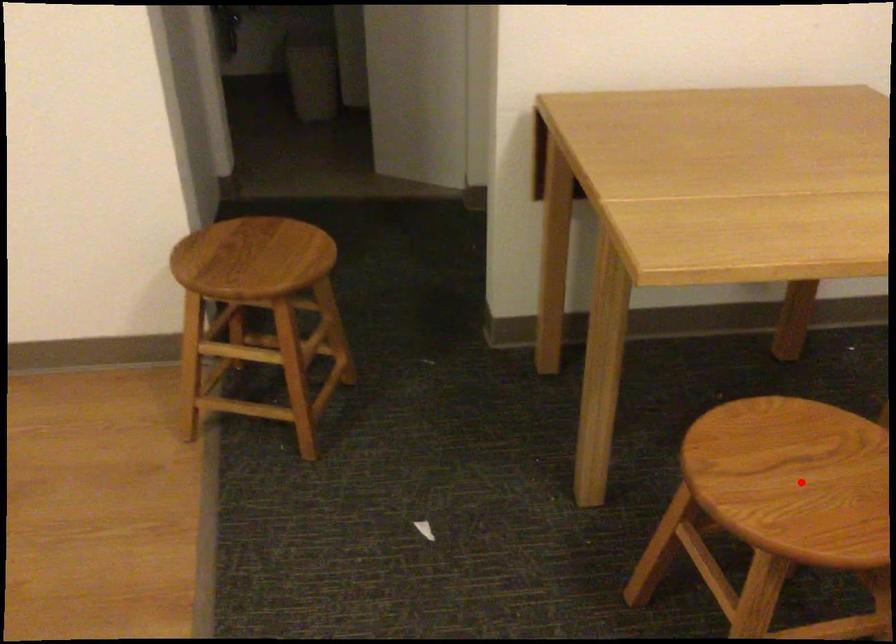
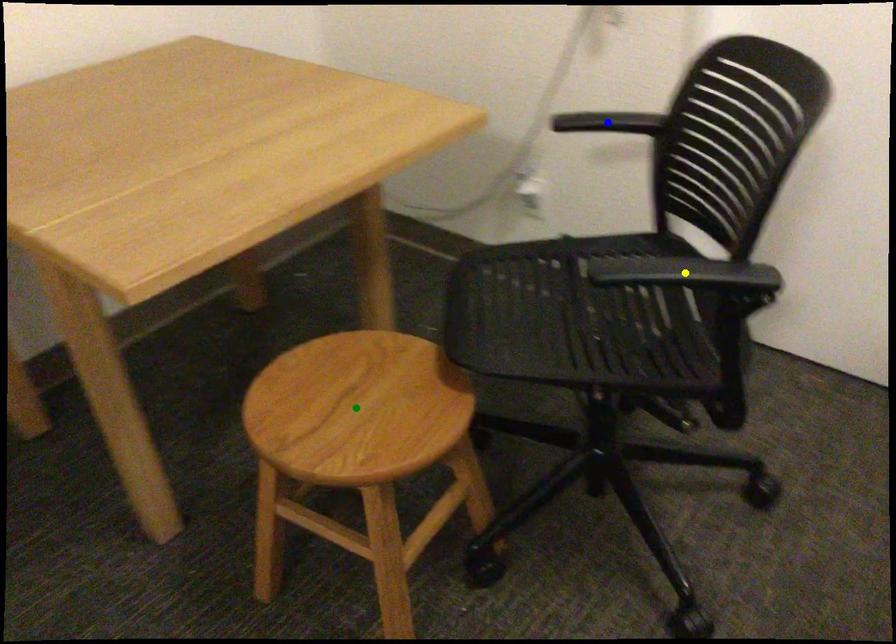
Question: I am providing you with two images of the same scene from different viewpoints. A red point is marked on the first image. You are given multiple points on the second image. Can you choose the point in image 2 that corresponds to the point in image 1?

Choices:
 (A) green point
 (B) blue point
 (C) yellow point

Answer: (A)